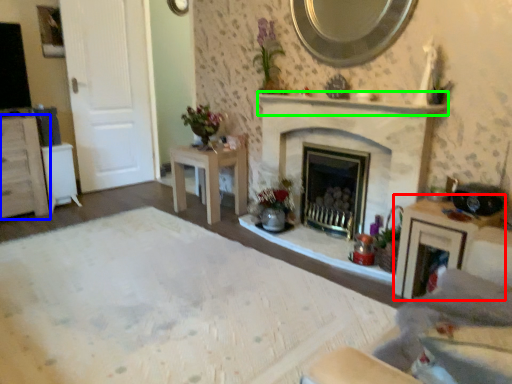
Question: Considering the real-world distances, which object is farthest from vanity (highlighted by a red box)? cabinetry (highlighted by a blue box) or mantle (highlighted by a green box)?

Choices:
 (A) cabinetry
 (B) mantle

Answer: (A)